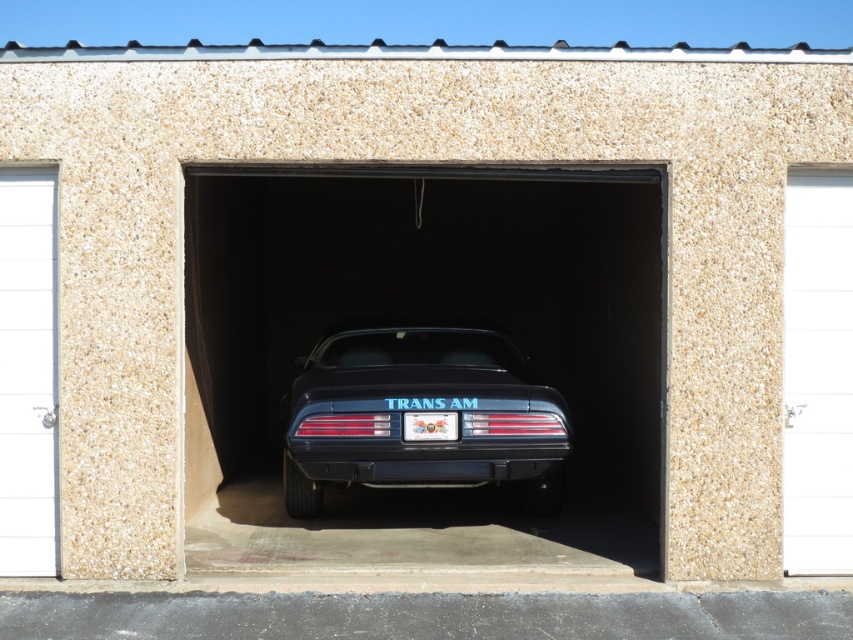
You are a delivery person trying to park your van in front of the garage. The glossy black trans am at center and the white smooth door at left are in your way. Which object should you move first to create space for your van?

The glossy black trans am at center should be moved first because it is positioned on the right side of the white smooth door at left, meaning it is closer to the entrance where you need to park your van.

You are standing in the garage and want to take a photo of the glossy black car at center. Where should you position yourself to capture the car in the frame?

You should position yourself at point (431, 342) to capture the glossy black car at center in the frame.

You are a delivery person trying to park your van in the garage. The van requires a height clearance of 2 meters. Given that the glossy black trans am at center is parked inside, can you determine if the white smooth door at left provides sufficient height clearance for your van?

The glossy black trans am at center is shorter than the white smooth door at left. Since the car is shorter than the door, the door likely has enough height clearance for the van as long as the door is at least 2 meters tall. However, without knowing the exact height of the door, we cannot confirm if it meets the 2 meter requirement.